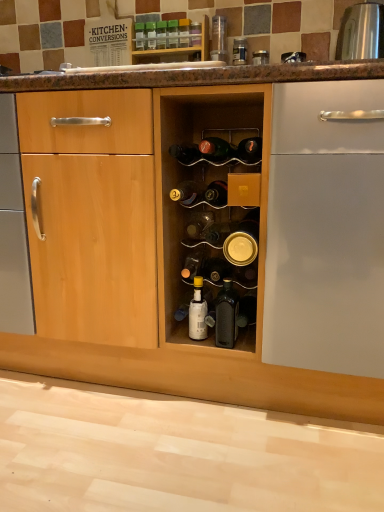
Question: From the image's perspective, is green glass bottle at upper center, the 13th bottle in the bottom-to-top sequence, above green glass bottle at center, acting as the second bottle starting from the top?

Choices:
 (A) no
 (B) yes

Answer: (B)

Question: Does green glass bottle at upper center, the 13th bottle in the bottom-to-top sequence, appear on the right side of green glass bottle at center, acting as the second bottle starting from the top?

Choices:
 (A) no
 (B) yes

Answer: (A)

Question: Does green glass bottle at upper center, which is the 1th bottle in top-to-bottom order, have a greater width compared to green glass bottle at center, the 12th bottle positioned from the bottom?

Choices:
 (A) no
 (B) yes

Answer: (A)

Question: Can you confirm if green glass bottle at upper center, the 13th bottle in the bottom-to-top sequence, is thinner than green glass bottle at center, acting as the second bottle starting from the top?

Choices:
 (A) yes
 (B) no

Answer: (A)

Question: Is green glass bottle at upper center, which is the 1th bottle in top-to-bottom order, in front of green glass bottle at center, the 12th bottle positioned from the bottom?

Choices:
 (A) yes
 (B) no

Answer: (B)

Question: Which is correct: white glossy bottle at center, which is the second bottle in bottom-to-top order, is inside matte black bottle at center, the eighth bottle from the bottom, or outside of it?

Choices:
 (A) inside
 (B) outside

Answer: (B)

Question: Is white glossy bottle at center, which is the second bottle in bottom-to-top order, to the left or to the right of matte black bottle at center, the eighth bottle from the bottom, in the image?

Choices:
 (A) left
 (B) right

Answer: (A)

Question: Is white glossy bottle at center, which is the second bottle in bottom-to-top order, in front of or behind matte black bottle at center, which appears as the sixth bottle when viewed from the top, in the image?

Choices:
 (A) front
 (B) behind

Answer: (B)

Question: From the image's perspective, is white glossy bottle at center, which is the second bottle in bottom-to-top order, positioned above or below matte black bottle at center, which appears as the sixth bottle when viewed from the top?

Choices:
 (A) above
 (B) below

Answer: (B)

Question: Based on their sizes in the image, would you say green glass bottle at upper center, the 13th bottle in the bottom-to-top sequence, is bigger or smaller than translucent glass bottle at center, arranged as the 6th bottle when ordered from the bottom?

Choices:
 (A) big
 (B) small

Answer: (B)

Question: Considering the positions of point (135, 37) and point (200, 216), is point (135, 37) closer or farther from the camera than point (200, 216)?

Choices:
 (A) farther
 (B) closer

Answer: (A)

Question: Looking at their shapes, would you say green glass bottle at upper center, the 13th bottle in the bottom-to-top sequence, is wider or thinner than translucent glass bottle at center, arranged as the 6th bottle when ordered from the bottom?

Choices:
 (A) thin
 (B) wide

Answer: (A)

Question: Is green glass bottle at upper center, the 13th bottle in the bottom-to-top sequence, taller or shorter than translucent glass bottle at center, the eighth bottle in the top-to-bottom sequence?

Choices:
 (A) short
 (B) tall

Answer: (B)

Question: From a real-world perspective, is green glass bottle at center, the 12th bottle positioned from the bottom, above or below gold metallic can at center, marked as the 9th bottle in a top-to-bottom arrangement?

Choices:
 (A) above
 (B) below

Answer: (A)

Question: Relative to gold metallic can at center, the fifth bottle positioned from the bottom, is green glass bottle at center, the 12th bottle positioned from the bottom, in front or behind?

Choices:
 (A) front
 (B) behind

Answer: (B)